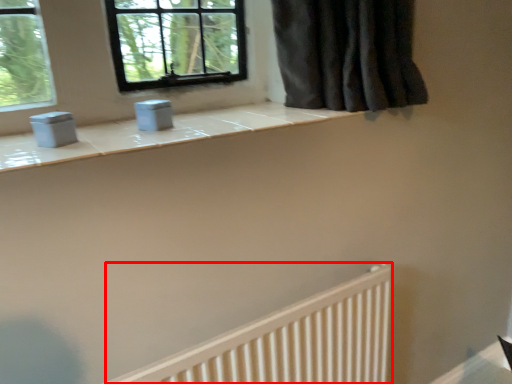
Question: From the image's perspective, where is radiator (annotated by the red box) located in relation to gray in the image?

Choices:
 (A) above
 (B) below

Answer: (B)